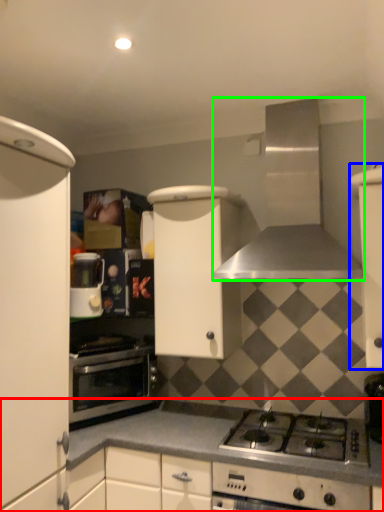
Question: Which object is the closest to the countertop (highlighted by a red box)? Choose among these: cabinetry (highlighted by a blue box) or kitchen appliance (highlighted by a green box).

Choices:
 (A) cabinetry
 (B) kitchen appliance

Answer: (A)